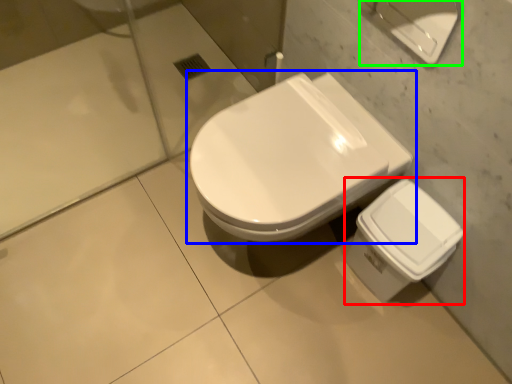
Question: Estimate the real-world distances between objects in this image. Which object is closer to porcelain (highlighted by a red box), toilet (highlighted by a blue box) or porcelain (highlighted by a green box)?

Choices:
 (A) toilet
 (B) porcelain

Answer: (A)